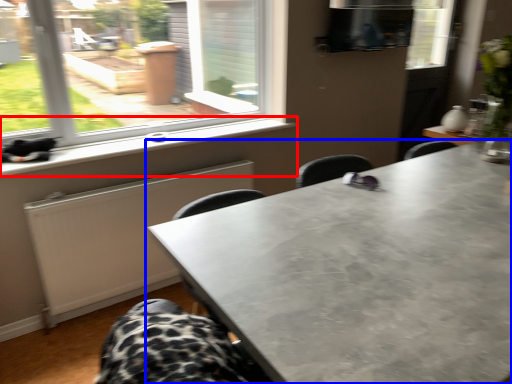
Question: Which point is closer to the camera, window sill (highlighted by a red box) or table (highlighted by a blue box)?

Choices:
 (A) window sill
 (B) table

Answer: (B)